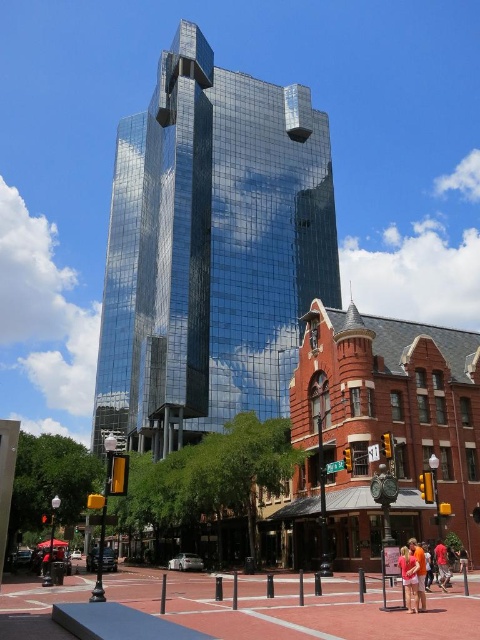
Question: Observing the image, what is the correct spatial positioning of pink fabric dress at center in reference to orange cotton shirt at lower center?

Choices:
 (A) right
 (B) left

Answer: (B)

Question: Among these objects, which one is farthest from the camera?

Choices:
 (A) red cotton shirt at lower right
 (B) orange cotton shirt at lower center
 (C) pink fabric dress at center

Answer: (A)

Question: Is shiny glass building at center to the left of pink fabric dress at center from the viewer's perspective?

Choices:
 (A) no
 (B) yes

Answer: (B)

Question: Which point is closer to the camera taking this photo?

Choices:
 (A) (219, 296)
 (B) (423, 573)

Answer: (B)

Question: Which point is farther from the camera taking this photo?

Choices:
 (A) (403, 580)
 (B) (311, 244)

Answer: (B)

Question: Does orange cotton shirt at lower center have a larger size compared to red cotton shirt at lower right?

Choices:
 (A) yes
 (B) no

Answer: (A)